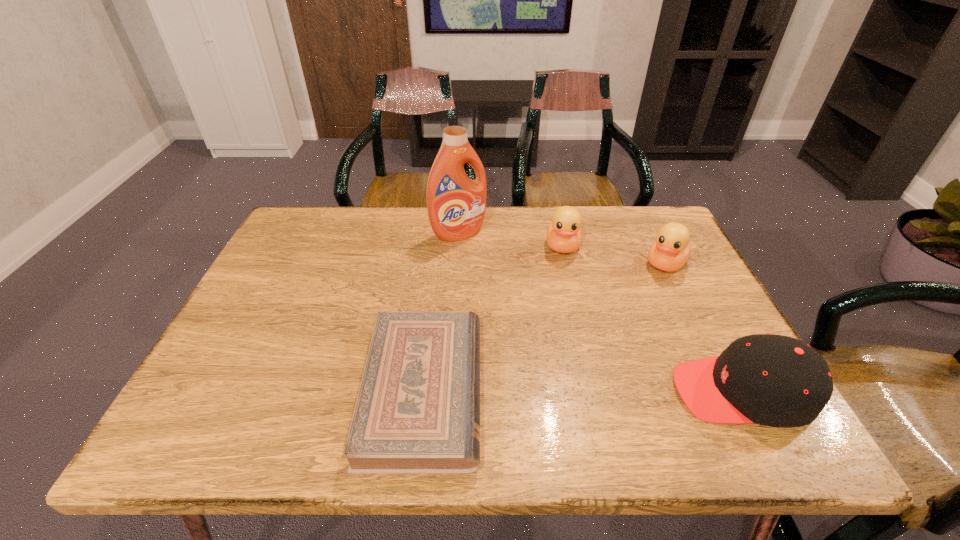
The width and height of the screenshot is (960, 540). I want to click on free space in the image that satisfies the following two spatial constraints: 1. on the front side of the cap; 2. on the front-facing side of the detergent, so click(449, 392).

Identify the location of vacant space that satisfies the following two spatial constraints: 1. on the front side of the cap; 2. on the front-facing side of the left duckling. (597, 392).

The width and height of the screenshot is (960, 540). What are the coordinates of `vacant space that satisfies the following two spatial constraints: 1. on the front side of the right duckling; 2. on the right side of the tallest object` in the screenshot? It's located at (457, 264).